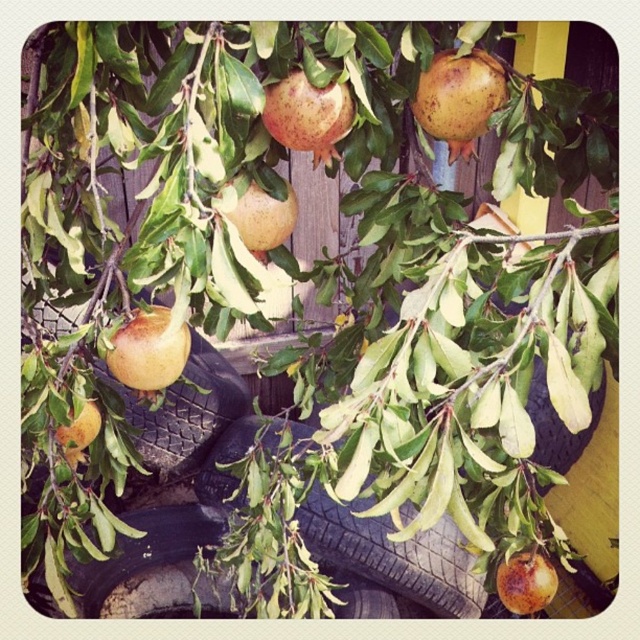
Question: Estimate the real-world distances between objects in this image. Which object is closer to the rubber tire at lower left?

Choices:
 (A) brown matte pomegranate at center
 (B) black rubber tire at lower left

Answer: (B)

Question: Is black rubber tire at center smaller than rustic brown pomegranate at center?

Choices:
 (A) no
 (B) yes

Answer: (A)

Question: Is rustic brown pomegranate at lower left behind ripe orange pomegranate at lower left?

Choices:
 (A) no
 (B) yes

Answer: (A)

Question: Which of these objects is positioned farthest from the rusty metallic pomegranate at lower right?

Choices:
 (A) rubber tire at lower left
 (B) black rubber tire at center
 (C) rough textured pomegranate at upper center
 (D) black rubber tire at lower left

Answer: (D)

Question: Can you confirm if black rubber tire at lower right is positioned to the left of brown matte pomegranate at center?

Choices:
 (A) yes
 (B) no

Answer: (B)

Question: Which point is farther to the camera?

Choices:
 (A) [296, 104]
 (B) [268, 221]
 (C) [492, 109]

Answer: (B)